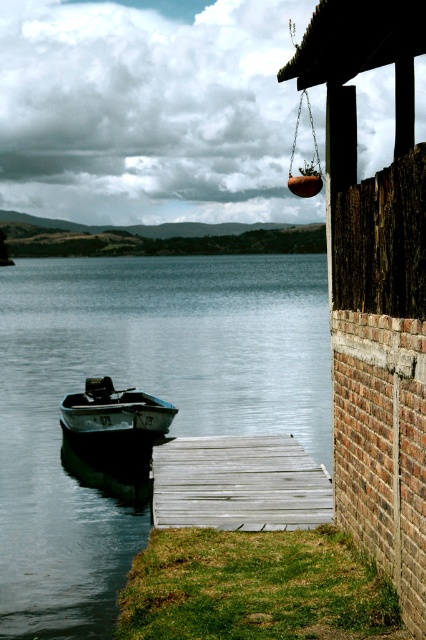
What do you see at coordinates (141, 388) in the screenshot? I see `smooth blue water at lower left` at bounding box center [141, 388].

Is point (19, 486) more distant than point (399, 520)?

Yes, it is behind point (399, 520).

Which is in front, point (97, 506) or point (362, 412)?

Point (362, 412)

Locate an element on the screen. smooth blue water at lower left is located at coordinates (141, 388).

Is weathered wood dock at lower center positioned behind green weathered metal boat at left?

No, weathered wood dock at lower center is closer to the viewer.

Between weathered wood dock at lower center and green weathered metal boat at left, which one has less height?

weathered wood dock at lower center

Where is `weathered wood dock at lower center`? The height and width of the screenshot is (640, 426). weathered wood dock at lower center is located at coordinates (238, 484).

Who is taller, smooth blue water at lower left or green weathered metal boat at left?

smooth blue water at lower left

The width and height of the screenshot is (426, 640). Describe the element at coordinates (141, 388) in the screenshot. I see `smooth blue water at lower left` at that location.

Where is `smooth blue water at lower left`? smooth blue water at lower left is located at coordinates (141, 388).